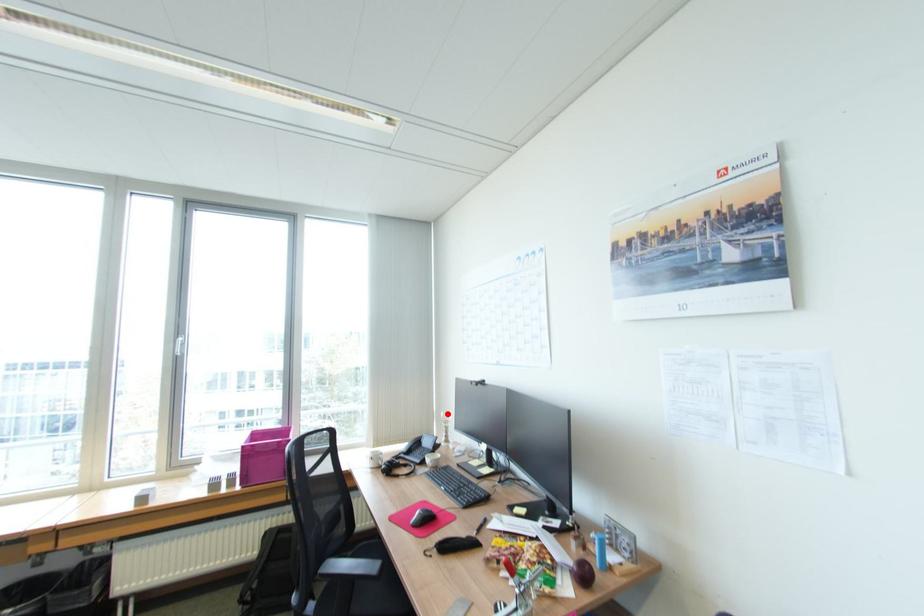
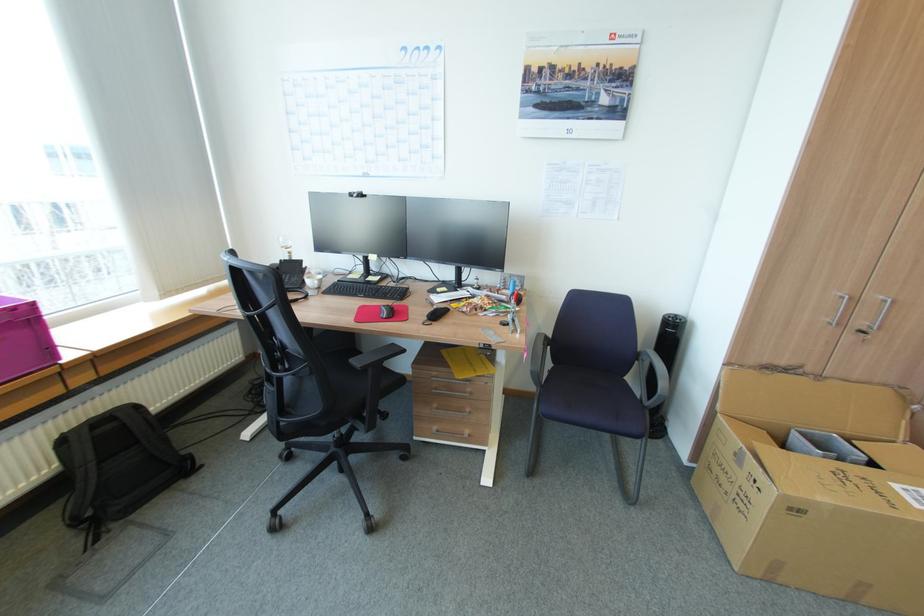
Question: I am providing you with two images of the same scene from different viewpoints. Given a red point in image1, look at the same physical point in image2. Is it:

Choices:
 (A) Closer to the viewpoint
 (B) Farther from the viewpoint

Answer: (A)